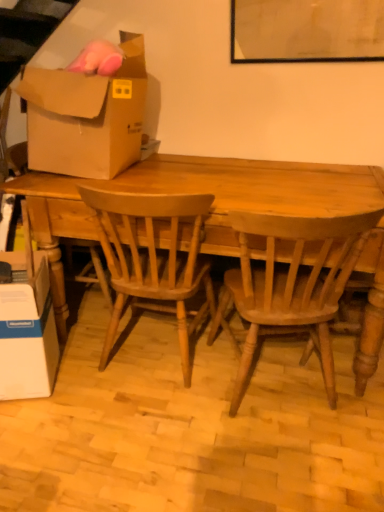
Question: From the image's perspective, is light brown wood chair at center, arranged as the 1th chair when viewed from the right, located above or below white cardboard box at lower left, arranged as the 1th box when ordered from the bottom?

Choices:
 (A) below
 (B) above

Answer: (B)

Question: Which is correct: light brown wood chair at center, the second chair when ordered from left to right, is inside white cardboard box at lower left, arranged as the 1th box when ordered from the bottom, or outside of it?

Choices:
 (A) inside
 (B) outside

Answer: (B)

Question: Which is farther from the light brown wood chair at center, the second chair when ordered from left to right?

Choices:
 (A) white cardboard box at lower left, positioned as the 2th box in top-to-bottom order
 (B) wooden table at center
 (C) brown cardboard box at upper left, placed as the 1th box when sorted from top to bottom
 (D) light brown wood chair at center, acting as the first chair starting from the left

Answer: (A)

Question: Which object is the closest to the brown cardboard box at upper left, placed as the 2th box when sorted from bottom to top?

Choices:
 (A) wooden table at center
 (B) white cardboard box at lower left, arranged as the 1th box when ordered from the bottom
 (C) light brown wood chair at center, acting as the first chair starting from the left
 (D) light brown wood chair at center, the second chair when ordered from left to right

Answer: (A)